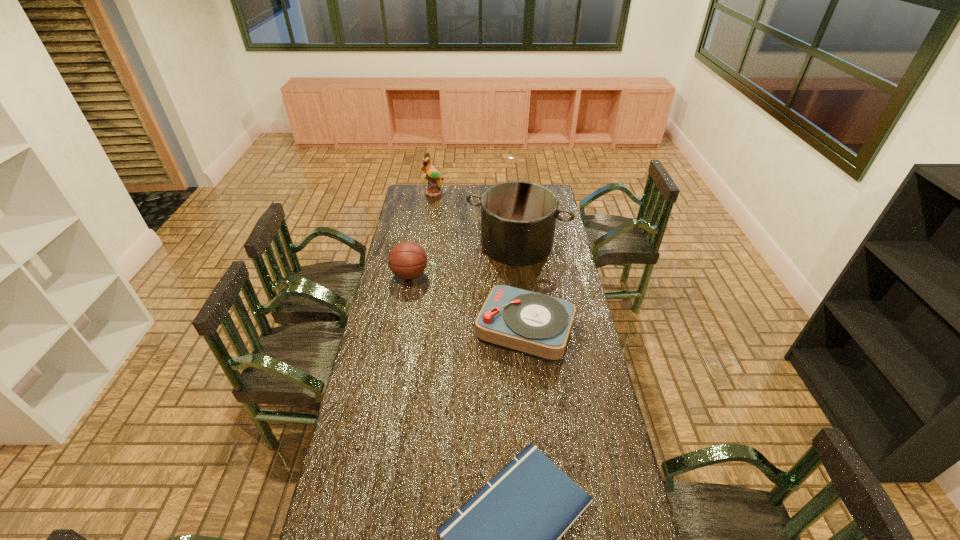
You are a GUI agent. You are given a task and a screenshot of the screen. Output one action in this format:
    pyautogui.click(x=<x>, y=<y>)
    Task: Click on the parrot
    This screenshot has width=960, height=540.
    Given the screenshot: What is the action you would take?
    pyautogui.click(x=433, y=176)

Locate an element on the screen. pan is located at coordinates (518, 218).

Where is `the third shortest object`? the third shortest object is located at coordinates (407, 260).

In order to click on record player in this screenshot , I will do `click(539, 325)`.

Where is `the second shortest object`? The width and height of the screenshot is (960, 540). the second shortest object is located at coordinates (539, 325).

The width and height of the screenshot is (960, 540). Find the location of `blank space located on the front-facing side of the parrot`. blank space located on the front-facing side of the parrot is located at coordinates (430, 216).

You are a GUI agent. You are given a task and a screenshot of the screen. Output one action in this format:
    pyautogui.click(x=<x>, y=<y>)
    Task: Click on the vacant space located 0.130m on the left of the pan
    This screenshot has width=960, height=540.
    Given the screenshot: What is the action you would take?
    pyautogui.click(x=442, y=244)

What are the coordinates of `free space located on the right of the third shortest object` in the screenshot? It's located at (497, 275).

At what (x,y) coordinates should I click in order to perform the action: click on vacant space situated on the front of the record player. Please return your answer as a coordinate pair (x, y). Looking at the image, I should click on (539, 462).

At what (x,y) coordinates should I click in order to perform the action: click on object at the far edge. Please return your answer as a coordinate pair (x, y). Looking at the image, I should click on (433, 176).